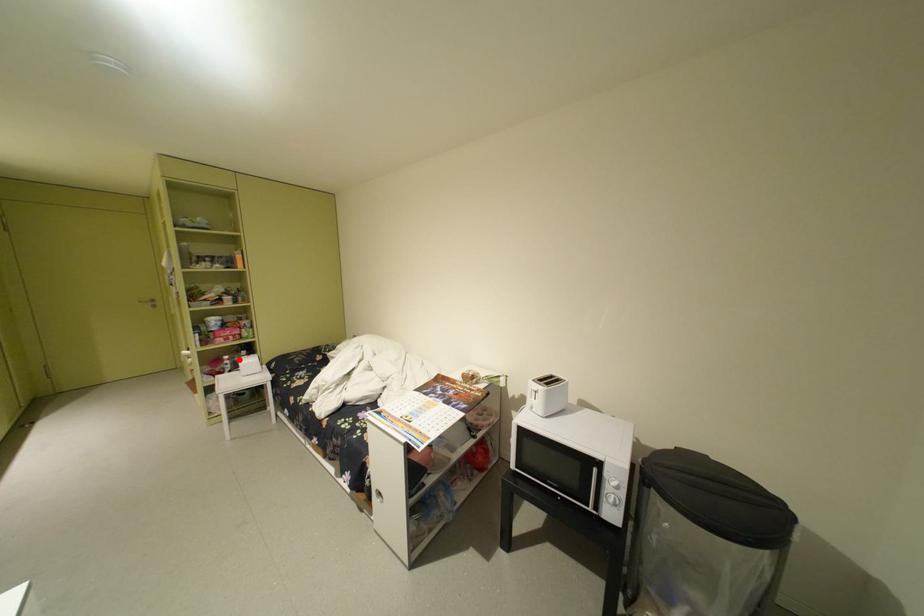
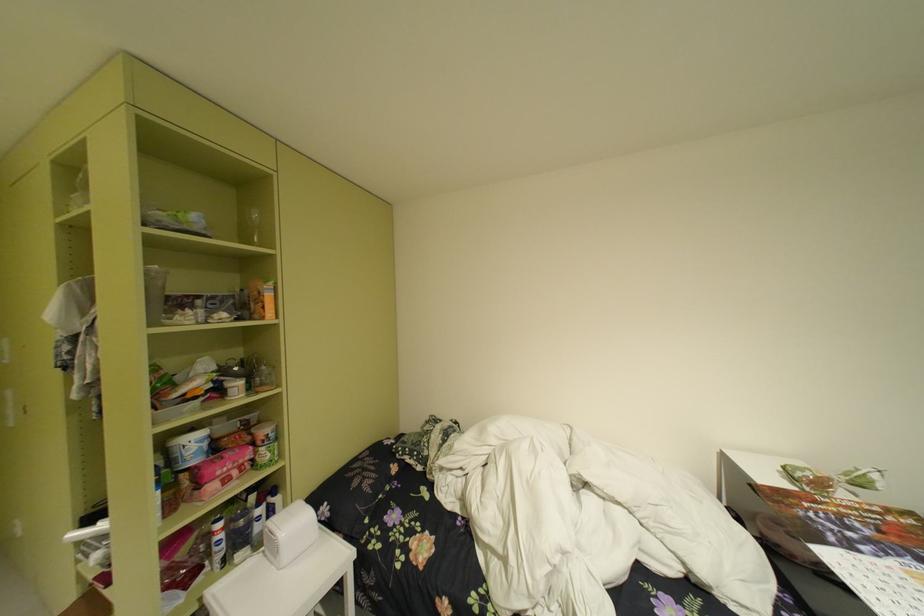
Question: I am providing you with two images of the same scene from different viewpoints. In image1, a red point is highlighted. Considering the same 3D point in image2, which of the following is correct?

Choices:
 (A) It is closer
 (B) It is farther

Answer: (A)